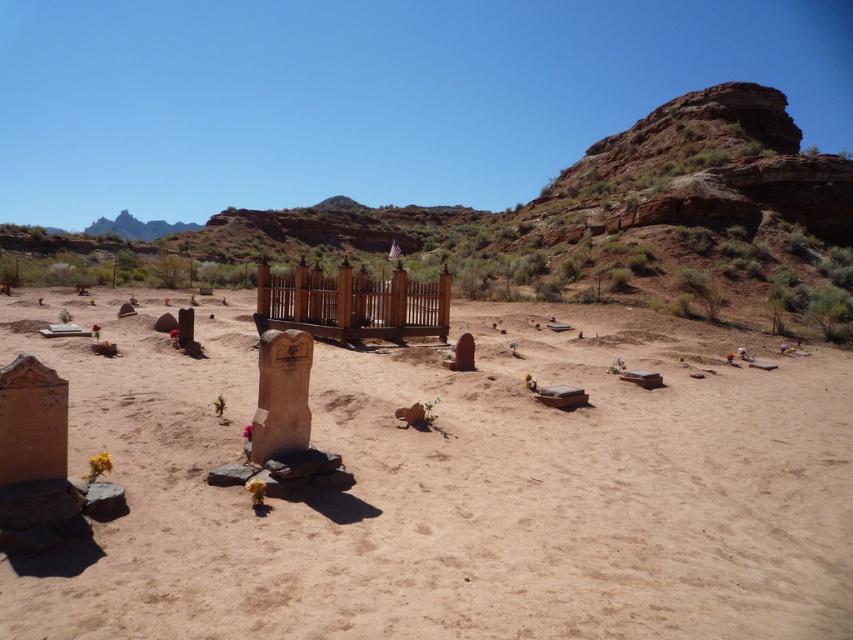
Is brown sandy dirt field at center above wooden fence at center?

Incorrect, brown sandy dirt field at center is not positioned above wooden fence at center.

The height and width of the screenshot is (640, 853). What do you see at coordinates (453, 484) in the screenshot? I see `brown sandy dirt field at center` at bounding box center [453, 484].

You are a GUI agent. You are given a task and a screenshot of the screen. Output one action in this format:
    pyautogui.click(x=<x>, y=<y>)
    Task: Click on the brown sandy dirt field at center
    This screenshot has height=640, width=853.
    Given the screenshot: What is the action you would take?
    click(453, 484)